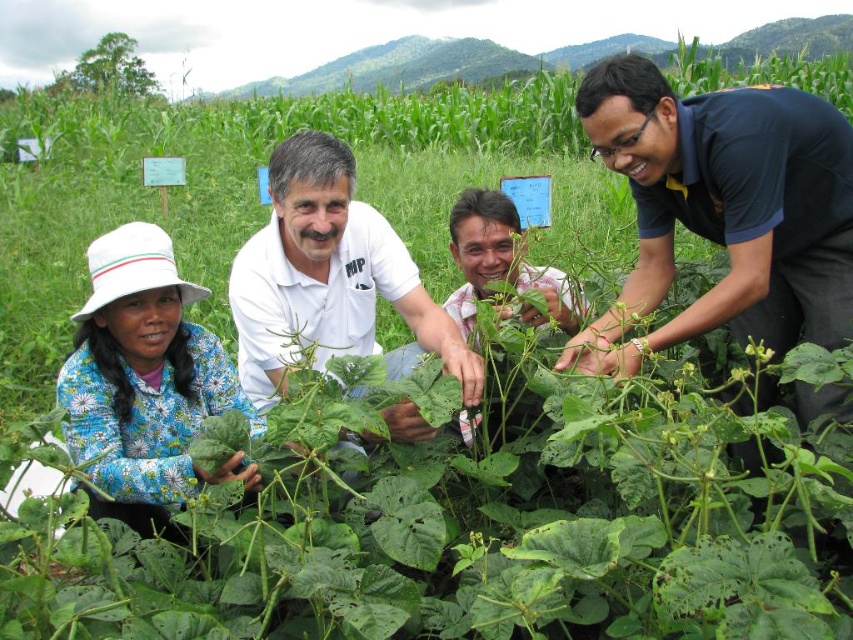
Between blue floral dress at lower left and white cotton shirt at center, which one has less height?

With less height is white cotton shirt at center.

Is blue floral dress at lower left to the left of white cotton shirt at center from the viewer's perspective?

Indeed, blue floral dress at lower left is positioned on the left side of white cotton shirt at center.

Is point (115, 435) positioned behind point (325, 301)?

No, it is in front of (325, 301).

Where is `blue floral dress at lower left`? This screenshot has width=853, height=640. blue floral dress at lower left is located at coordinates (144, 384).

Is point (630, 284) less distant than point (256, 486)?

No.

Does dark blue shirt at center have a greater height compared to blue floral dress at lower left?

Indeed, dark blue shirt at center has a greater height compared to blue floral dress at lower left.

Is point (820, 218) closer to camera compared to point (189, 301)?

Yes, point (820, 218) is closer to viewer.

The image size is (853, 640). I want to click on dark blue shirt at center, so click(x=723, y=209).

Does dark blue shirt at center have a smaller size compared to white cotton shirt at center?

Yes.

Who is shorter, dark blue shirt at center or white cotton shirt at center?

white cotton shirt at center

Between point (752, 292) and point (347, 227), which one is positioned in front?

Point (752, 292) is more forward.

Identify the location of dark blue shirt at center. (723, 209).